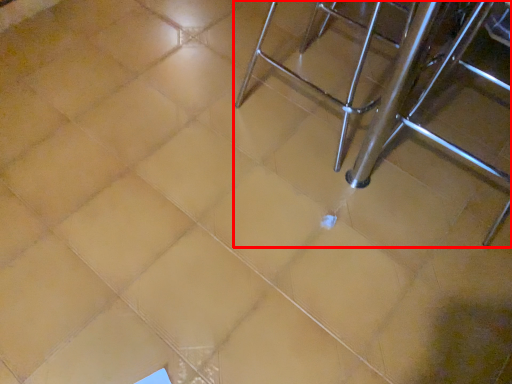
Question: From the image's perspective, where is furniture (annotated by the red box) located relative to chair?

Choices:
 (A) above
 (B) below

Answer: (A)